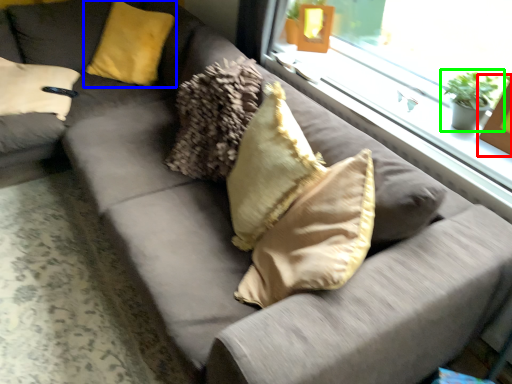
Question: Considering the real-world distances, which object is closest to picture frame (highlighted by a red box)? pillow (highlighted by a blue box) or houseplant (highlighted by a green box).

Choices:
 (A) pillow
 (B) houseplant

Answer: (B)